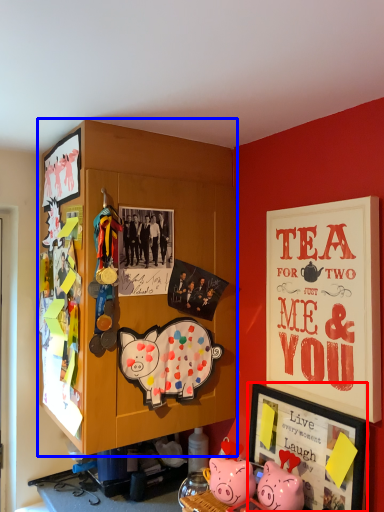
Question: Among these objects, which one is farthest to the camera, picture frame (highlighted by a red box) or cabinetry (highlighted by a blue box)?

Choices:
 (A) picture frame
 (B) cabinetry

Answer: (B)